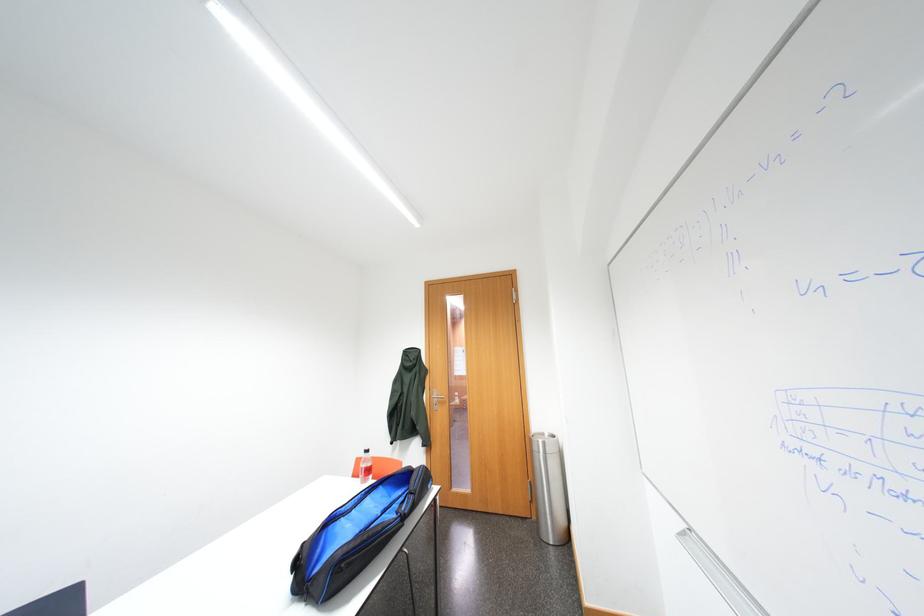
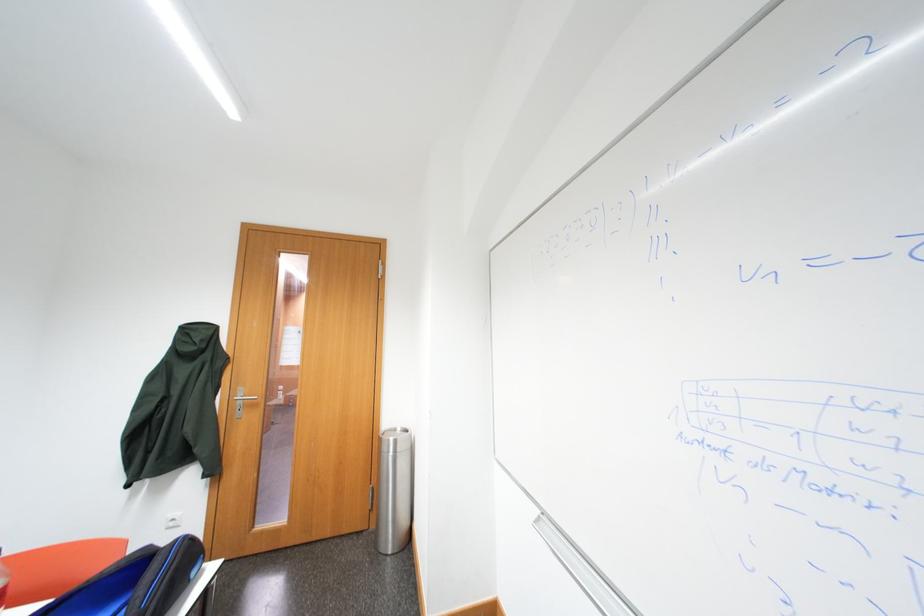
Question: The camera is either moving clockwise (left) or counter-clockwise (right) around the object. The first image is from the beginning of the video and the second image is from the end. Is the camera moving left or right when shooting the video?

Choices:
 (A) Left
 (B) Right

Answer: (A)